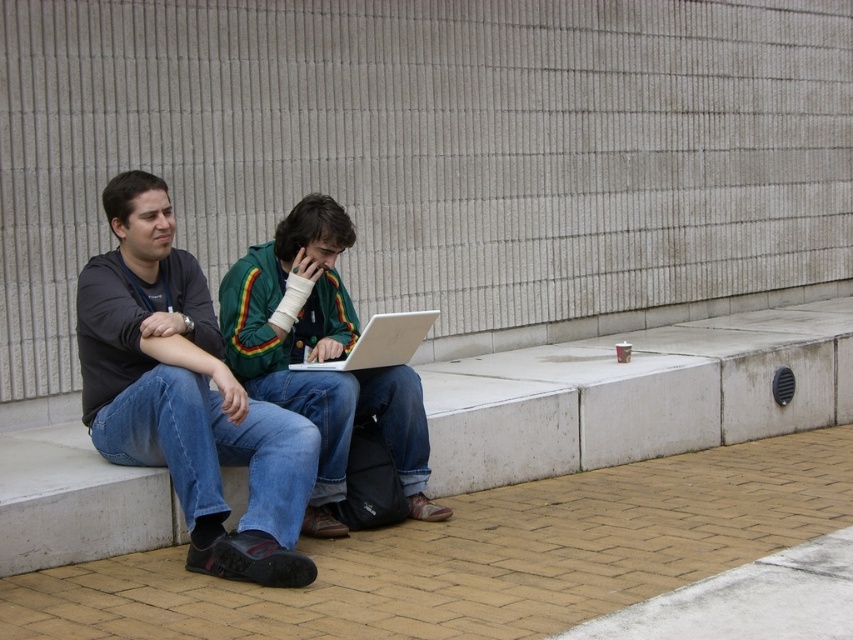
Question: Can you confirm if brick pavement at lower center is positioned above green textured jacket at center?

Choices:
 (A) no
 (B) yes

Answer: (A)

Question: Based on their relative distances, which object is farther from the dark gray fabric shirt at center?

Choices:
 (A) silver metallic laptop at center
 (B) green textured jacket at center
 (C) brick pavement at lower center

Answer: (C)

Question: Among these points, which one is nearest to the camera?

Choices:
 (A) (316, 355)
 (B) (381, 352)
 (C) (766, 480)

Answer: (B)

Question: Is the position of dark gray fabric shirt at center more distant than that of green textured jacket at center?

Choices:
 (A) no
 (B) yes

Answer: (A)

Question: Based on their relative distances, which object is nearer to the dark gray fabric shirt at center?

Choices:
 (A) silver metallic laptop at center
 (B) green textured jacket at center
 (C) brick pavement at lower center

Answer: (B)

Question: Does white concrete ledge at center appear on the right side of green textured jacket at center?

Choices:
 (A) yes
 (B) no

Answer: (A)